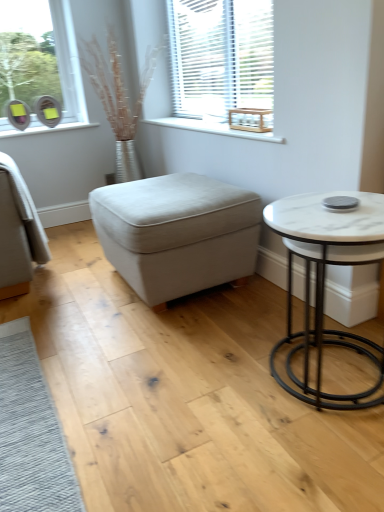
Question: Does beige fabric ottoman at center appear on the right side of white marble table at right?

Choices:
 (A) no
 (B) yes

Answer: (A)

Question: Considering the relative sizes of beige fabric ottoman at center and white marble table at right in the image provided, is beige fabric ottoman at center wider than white marble table at right?

Choices:
 (A) yes
 (B) no

Answer: (A)

Question: Is beige fabric ottoman at center far away from white marble table at right?

Choices:
 (A) yes
 (B) no

Answer: (B)

Question: Is beige fabric ottoman at center not inside white marble table at right?

Choices:
 (A) no
 (B) yes

Answer: (B)

Question: Would you say beige fabric ottoman at center contains white marble table at right?

Choices:
 (A) no
 (B) yes

Answer: (A)

Question: Is point (188, 272) closer or farther from the camera than point (183, 31)?

Choices:
 (A) closer
 (B) farther

Answer: (A)

Question: From the image's perspective, is beige fabric ottoman at center positioned above or below white wooden blinds at upper center?

Choices:
 (A) below
 (B) above

Answer: (A)

Question: Visually, is beige fabric ottoman at center positioned to the left or to the right of white wooden blinds at upper center?

Choices:
 (A) right
 (B) left

Answer: (B)

Question: From their relative heights in the image, would you say beige fabric ottoman at center is taller or shorter than white wooden blinds at upper center?

Choices:
 (A) short
 (B) tall

Answer: (A)

Question: Looking at the image, does white marble table at right seem bigger or smaller compared to white wood at upper center?

Choices:
 (A) small
 (B) big

Answer: (B)

Question: From the image's perspective, is white marble table at right above or below white wood at upper center?

Choices:
 (A) below
 (B) above

Answer: (A)

Question: Is point (291, 197) positioned closer to the camera than point (185, 120)?

Choices:
 (A) closer
 (B) farther

Answer: (A)

Question: In the image, is white marble table at right positioned in front of or behind white wood at upper center?

Choices:
 (A) behind
 (B) front

Answer: (B)

Question: From a real-world perspective, relative to white marble table at right, is beige fabric ottoman at center vertically above or below?

Choices:
 (A) below
 (B) above

Answer: (A)

Question: Is beige fabric ottoman at center spatially inside white marble table at right, or outside of it?

Choices:
 (A) outside
 (B) inside

Answer: (A)